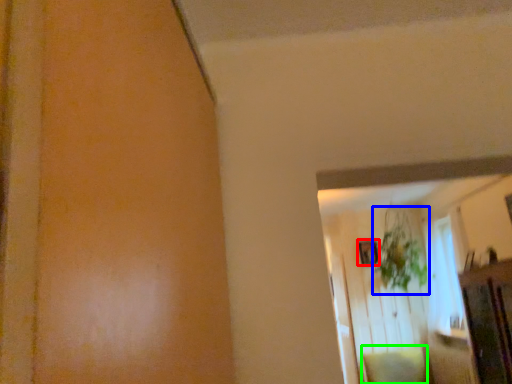
Question: Which object is the closest to the picture frame (highlighted by a red box)? Choose among these: plant (highlighted by a blue box) or pillow (highlighted by a green box).

Choices:
 (A) plant
 (B) pillow

Answer: (A)